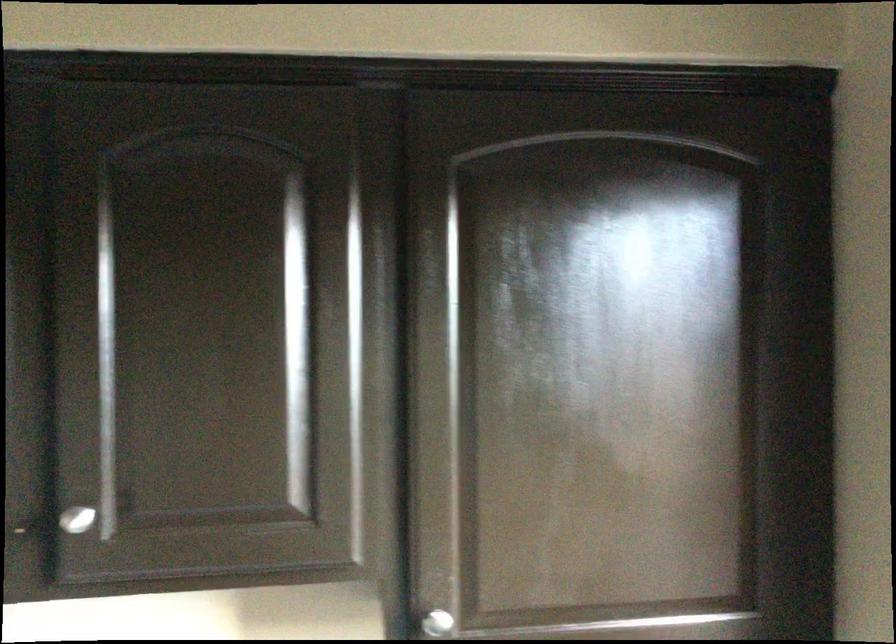
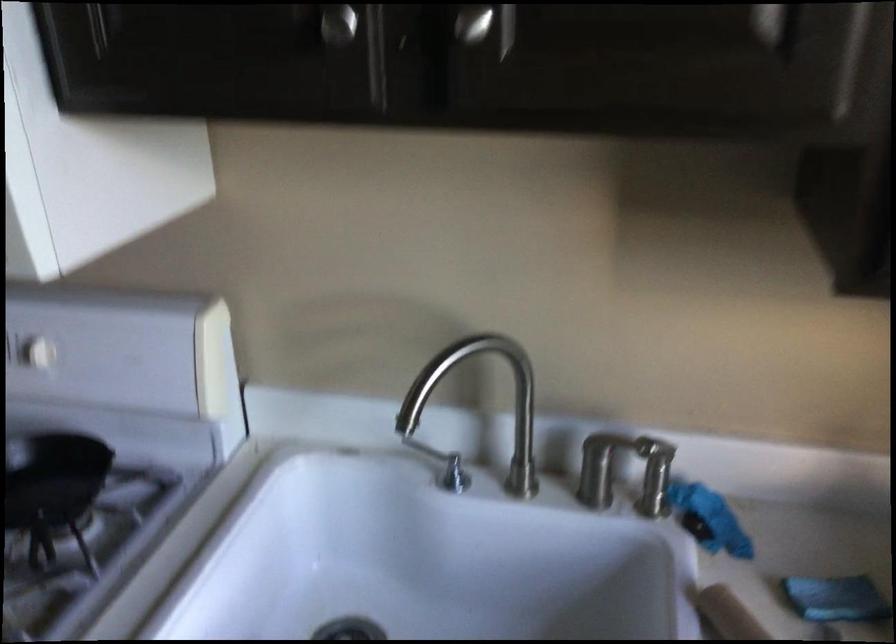
Where in the second image is the point corresponding to point 316,505 from the first image?

(794, 24)